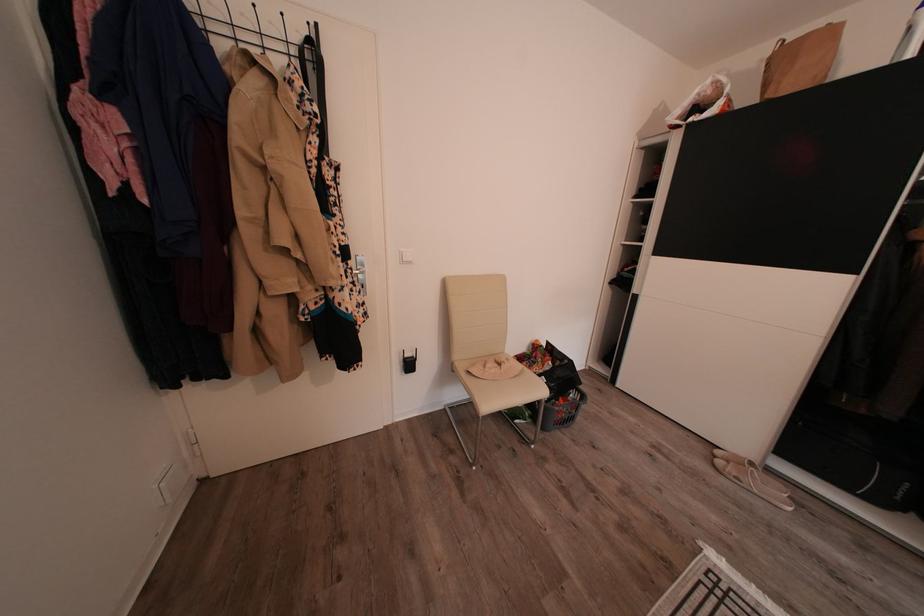
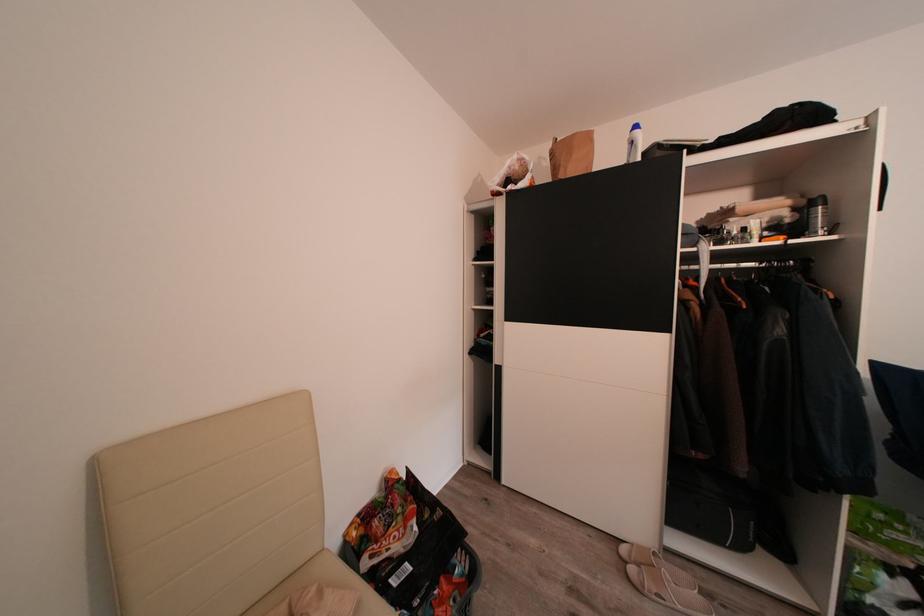
In the second image, find the point that corresponds to point 773,91 in the first image.

(564, 174)